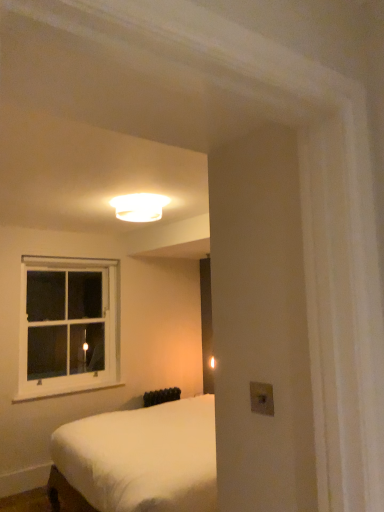
Where is `black matte radiator at lower center`? black matte radiator at lower center is located at coordinates pyautogui.click(x=161, y=396).

Consider the image. From the image's perspective, between white glossy ceiling light at upper center and black matte radiator at lower center, which one is located above?

From the image's view, white glossy ceiling light at upper center is above.

Considering the sizes of objects white glossy ceiling light at upper center and black matte radiator at lower center in the image provided, who is smaller, white glossy ceiling light at upper center or black matte radiator at lower center?

white glossy ceiling light at upper center.

Is white glossy ceiling light at upper center oriented towards black matte radiator at lower center?

No, white glossy ceiling light at upper center is not oriented towards black matte radiator at lower center.

Is white glossy ceiling light at upper center positioned beyond the bounds of black matte radiator at lower center?

white glossy ceiling light at upper center is positioned outside black matte radiator at lower center.

Between white wooden window at upper left and black matte radiator at lower center, which one has more height?

With more height is white wooden window at upper left.

Considering the positions of point (87, 328) and point (148, 403), is point (87, 328) closer or farther from the camera than point (148, 403)?

Point (87, 328).

From the image's perspective, is white wooden window at upper left on black matte radiator at lower center?

Correct, white wooden window at upper left appears higher than black matte radiator at lower center in the image.

Would you say white wooden window at upper left is to the left or to the right of black matte radiator at lower center in the picture?

white wooden window at upper left is positioned on black matte radiator at lower center's left side.

Looking at this image, measure the distance between white glossy ceiling light at upper center and white wooden window at upper left.

A distance of 1.26 meters exists between white glossy ceiling light at upper center and white wooden window at upper left.

Is the position of white glossy ceiling light at upper center less distant than that of white wooden window at upper left?

Yes, the depth of white glossy ceiling light at upper center is less than that of white wooden window at upper left.

Is white glossy ceiling light at upper center facing away from white wooden window at upper left?

No, white wooden window at upper left is not at the back of white glossy ceiling light at upper center.

Which is in front, point (83, 385) or point (24, 325)?

Point (24, 325)

Is white painted wood at lower left positioned with its back to white wooden window at upper left?

No, white painted wood at lower left is not facing away from white wooden window at upper left.

Which is more to the left, white painted wood at lower left or white wooden window at upper left?

white wooden window at upper left.

Is white painted wood at lower left not inside white wooden window at upper left?

No, white painted wood at lower left is inside or overlapping with white wooden window at upper left.

The width and height of the screenshot is (384, 512). In order to click on window sill in front of the white wooden window at upper left in this screenshot , I will do `click(65, 391)`.

Is point (59, 298) in front of point (18, 402)?

No, (59, 298) is behind (18, 402).

Which object is closer to the camera, white wooden window at upper left or white painted wood at lower left?

white painted wood at lower left is more forward.

From the picture: Does white painted wood at lower left have a lesser width compared to white glossy ceiling light at upper center?

Yes.

Can you confirm if white painted wood at lower left is bigger than white glossy ceiling light at upper center?

Actually, white painted wood at lower left might be smaller than white glossy ceiling light at upper center.

Which object is further away from the camera taking this photo, white painted wood at lower left or white glossy ceiling light at upper center?

white painted wood at lower left is more distant.

In the scene shown: Is white glossy ceiling light at upper center at the back of white painted wood at lower left?

white painted wood at lower left is not turned away from white glossy ceiling light at upper center.

Is black matte radiator at lower center smaller than white glossy ceiling light at upper center?

No.

Consider the image. Is black matte radiator at lower center wider than white glossy ceiling light at upper center?

Incorrect, the width of black matte radiator at lower center does not surpass that of white glossy ceiling light at upper center.

Relative to white glossy ceiling light at upper center, is black matte radiator at lower center in front or behind?

Clearly, black matte radiator at lower center is behind white glossy ceiling light at upper center.

From the image's perspective, which one is positioned higher, black matte radiator at lower center or white glossy ceiling light at upper center?

white glossy ceiling light at upper center, from the image's perspective.

You are a GUI agent. You are given a task and a screenshot of the screen. Output one action in this format:
    pyautogui.click(x=<x>, y=<y>)
    Task: Click on the lamp above the black matte radiator at lower center (from a real-world perspective)
    The width and height of the screenshot is (384, 512).
    Given the screenshot: What is the action you would take?
    pyautogui.click(x=139, y=207)

Locate an element on the screen. The height and width of the screenshot is (512, 384). radiator that is on the right side of white wooden window at upper left is located at coordinates (161, 396).

When comparing their distances from white wooden window at upper left, does black matte radiator at lower center or white glossy ceiling light at upper center seem further?

The object further to white wooden window at upper left is white glossy ceiling light at upper center.

Which object lies nearer to the anchor point white glossy ceiling light at upper center, black matte radiator at lower center or white painted wood at lower left?

The object closer to white glossy ceiling light at upper center is white painted wood at lower left.

From the image, which object appears to be farther from white wooden window at upper left, white painted wood at lower left or black matte radiator at lower center?

black matte radiator at lower center lies further to white wooden window at upper left than the other object.

Estimate the real-world distances between objects in this image. Which object is further from white glossy ceiling light at upper center, white wooden window at upper left or white painted wood at lower left?

Among the two, white painted wood at lower left is located further to white glossy ceiling light at upper center.

Which object lies nearer to the anchor point white wooden window at upper left, white glossy ceiling light at upper center or white painted wood at lower left?

white painted wood at lower left.

From the image, which object appears to be farther from white painted wood at lower left, black matte radiator at lower center or white glossy ceiling light at upper center?

The object further to white painted wood at lower left is white glossy ceiling light at upper center.

When comparing their distances from white painted wood at lower left, does black matte radiator at lower center or white wooden window at upper left seem closer?

white wooden window at upper left is closer to white painted wood at lower left.

Based on their spatial positions, is white wooden window at upper left or white glossy ceiling light at upper center closer to black matte radiator at lower center?

white wooden window at upper left is positioned closer to the anchor black matte radiator at lower center.

The width and height of the screenshot is (384, 512). What are the coordinates of `window sill between white glossy ceiling light at upper center and black matte radiator at lower center in the vertical direction` in the screenshot? It's located at (65, 391).

In order to click on window between white glossy ceiling light at upper center and white painted wood at lower left from top to bottom in this screenshot , I will do `click(68, 326)`.

The width and height of the screenshot is (384, 512). Find the location of `window sill between white wooden window at upper left and black matte radiator at lower center in the horizontal direction`. window sill between white wooden window at upper left and black matte radiator at lower center in the horizontal direction is located at coordinates (65, 391).

You are a GUI agent. You are given a task and a screenshot of the screen. Output one action in this format:
    pyautogui.click(x=<x>, y=<y>)
    Task: Click on the window that lies between white glossy ceiling light at upper center and black matte radiator at lower center from top to bottom
    This screenshot has height=512, width=384.
    Given the screenshot: What is the action you would take?
    pyautogui.click(x=68, y=326)